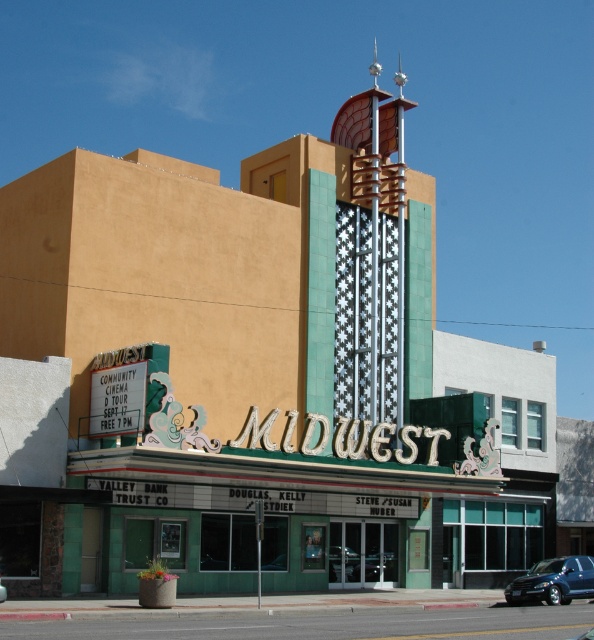
You are a visitor arriving at the Midwest Theatre. You see a metallic blue suv at center and a metallic blue car at center. Which one is positioned lower from the ground?

The metallic blue suv at center is positioned lower from the ground than the metallic blue car at center.

You are a pedestrian standing in front of the Midwest Theatre. You see a metallic blue suv at center and a metallic blue car at center. Which one is closer to you?

The metallic blue suv at center is closer to you because the metallic blue car at center is behind it.

From the picture: You are a parking attendant at the Midwest Theatre. You need to park two vehicles, a metallic blue suv at center and a metallic blue car at center, in a parking spot that has a height restriction of 1.6 meters. Which vehicle is more likely to exceed the height limit?

The metallic blue suv at center has a greater height compared to the metallic blue car at center, so it is more likely to exceed the 1.6 meters height limit.